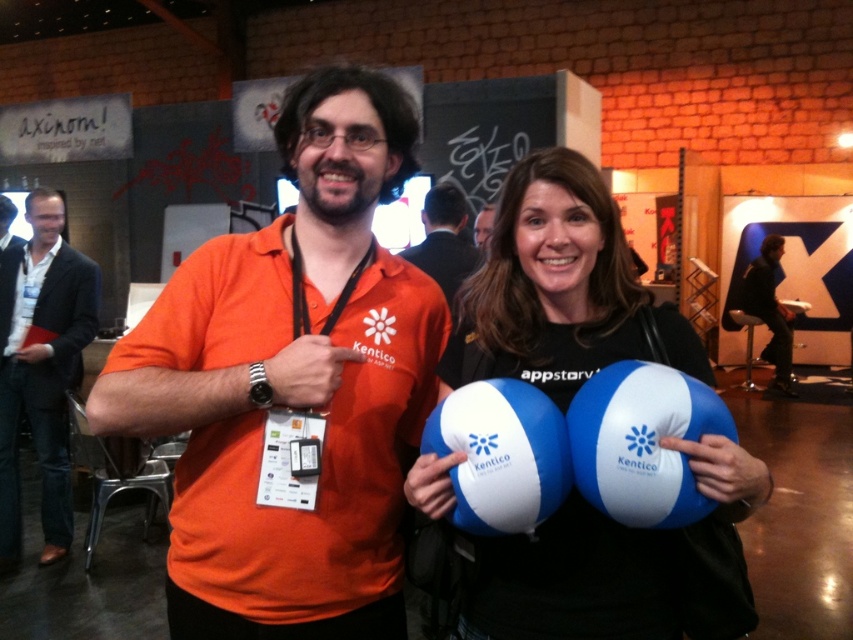
You are organizing a photo shoot and need to ensure that the blue rubber balloons at center and the dark blue suit at left are both visible in the frame. Given their sizes, which object might require more strategic positioning to avoid being overshadowed?

The blue rubber balloons at center occupy less space than the dark blue suit at left, so they might require more strategic positioning to avoid being overshadowed.